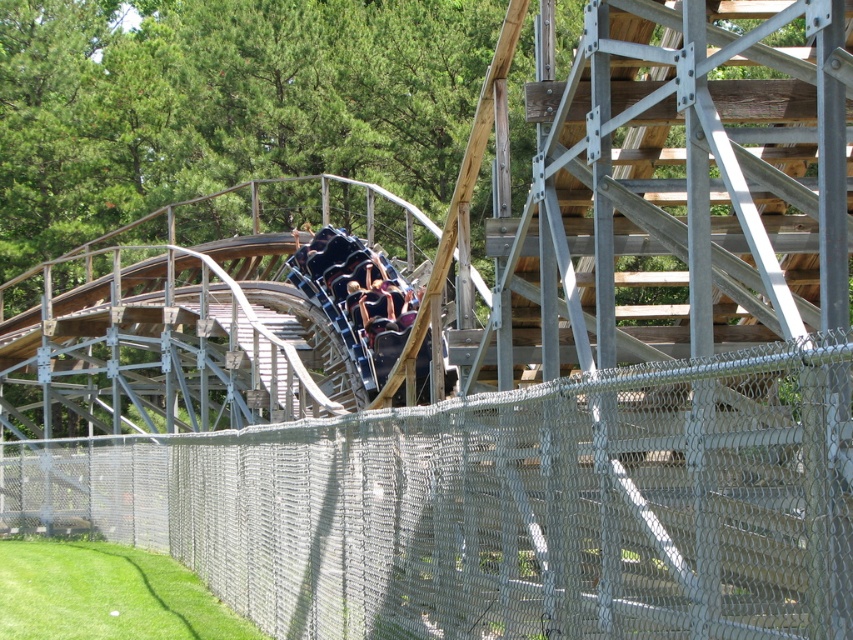
Does point (601, 480) come closer to viewer compared to point (372, 280)?

Yes, it is in front of point (372, 280).

Looking at this image, measure the distance from silver chain-link fence at center to metallic blue slide at center.

The distance of silver chain-link fence at center from metallic blue slide at center is 4.59 meters.

Locate an element on the screen. Image resolution: width=853 pixels, height=640 pixels. silver chain-link fence at center is located at coordinates (502, 506).